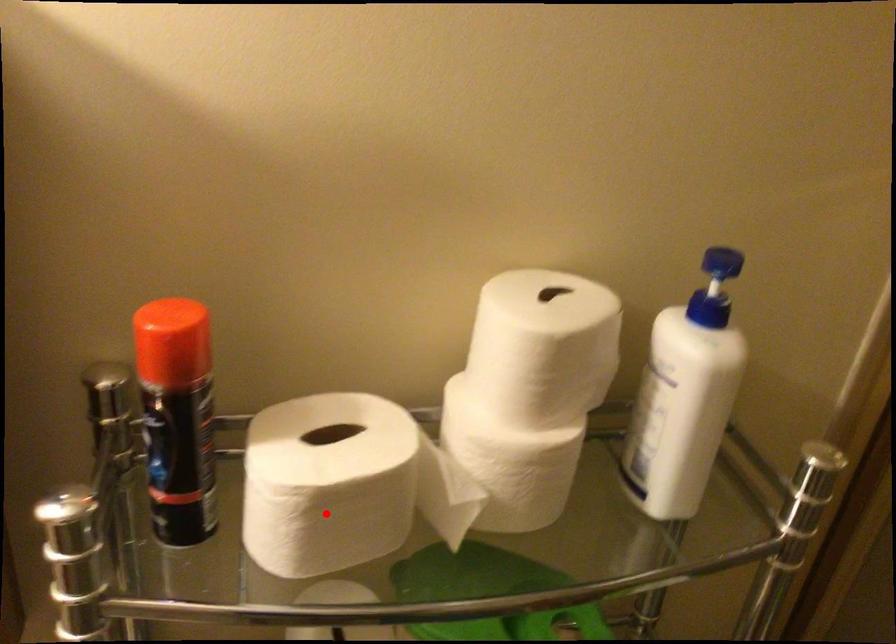
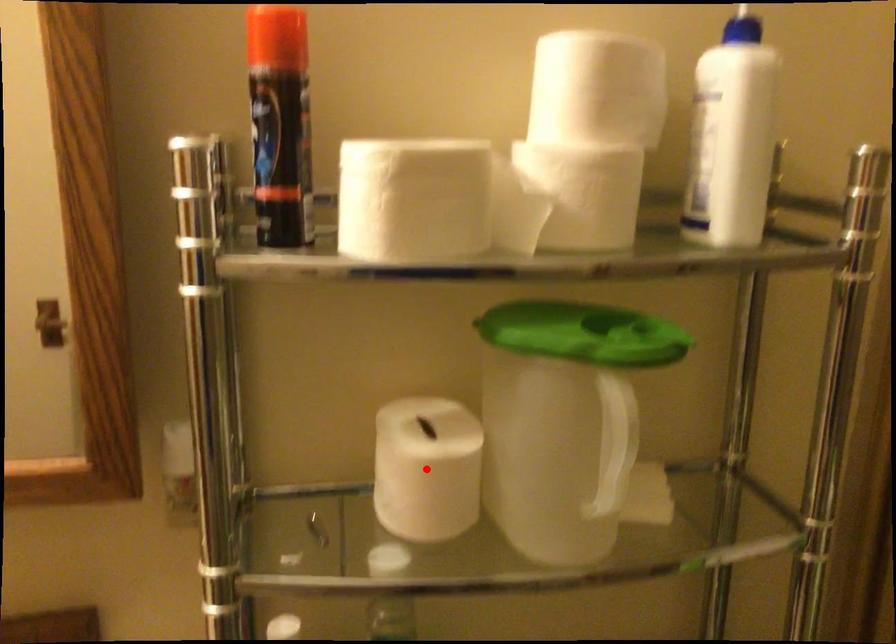
I am providing you with two images of the same scene from different viewpoints. A red point is marked on the first image and another point is marked on the second image. Is the marked point in image1 the same physical position as the marked point in image2?

No